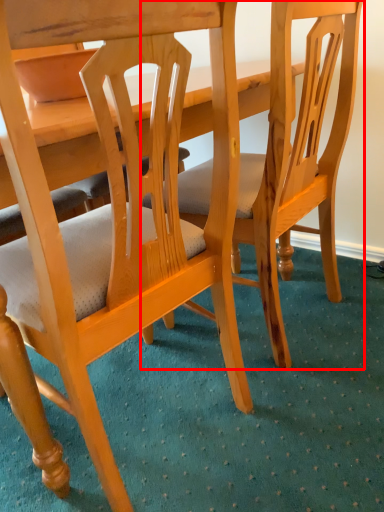
Question: From the image's perspective, what is the correct spatial positioning of chair (annotated by the red box) in reference to chair?

Choices:
 (A) below
 (B) above

Answer: (B)